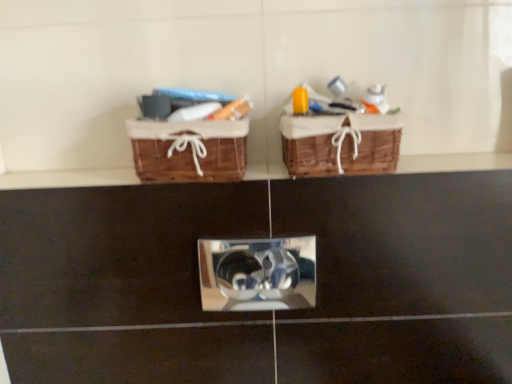
Question: From the image's perspective, relative to woven brown picnic basket at upper center, which appears as the 2th picnic basket when viewed from the right, is woven brown picnic basket at upper center, which is counted as the 1th picnic basket, starting from the right, above or below?

Choices:
 (A) above
 (B) below

Answer: (A)

Question: Based on their sizes in the image, would you say woven brown picnic basket at upper center, which is counted as the 1th picnic basket, starting from the right, is bigger or smaller than woven brown picnic basket at upper center, which appears as the 2th picnic basket when viewed from the right?

Choices:
 (A) big
 (B) small

Answer: (A)

Question: Looking at their shapes, would you say woven brown picnic basket at upper center, which is counted as the 1th picnic basket, starting from the right, is wider or thinner than woven brown picnic basket at upper center, which is counted as the first picnic basket, starting from the left?

Choices:
 (A) thin
 (B) wide

Answer: (B)

Question: Which is correct: woven brown picnic basket at upper center, which is counted as the first picnic basket, starting from the left, is inside woven brown picnic basket at upper center, the second picnic basket when ordered from left to right, or outside of it?

Choices:
 (A) outside
 (B) inside

Answer: (A)

Question: Is woven brown picnic basket at upper center, which appears as the 2th picnic basket when viewed from the right, in front of or behind woven brown picnic basket at upper center, which is counted as the 1th picnic basket, starting from the right, in the image?

Choices:
 (A) behind
 (B) front

Answer: (A)

Question: From a real-world perspective, is woven brown picnic basket at upper center, which is counted as the first picnic basket, starting from the left, above or below woven brown picnic basket at upper center, which is counted as the 1th picnic basket, starting from the right?

Choices:
 (A) above
 (B) below

Answer: (B)

Question: Considering the positions of woven brown picnic basket at upper center, which appears as the 2th picnic basket when viewed from the right, and woven brown picnic basket at upper center, the second picnic basket when ordered from left to right, in the image, is woven brown picnic basket at upper center, which appears as the 2th picnic basket when viewed from the right, taller or shorter than woven brown picnic basket at upper center, the second picnic basket when ordered from left to right,?

Choices:
 (A) short
 (B) tall

Answer: (A)